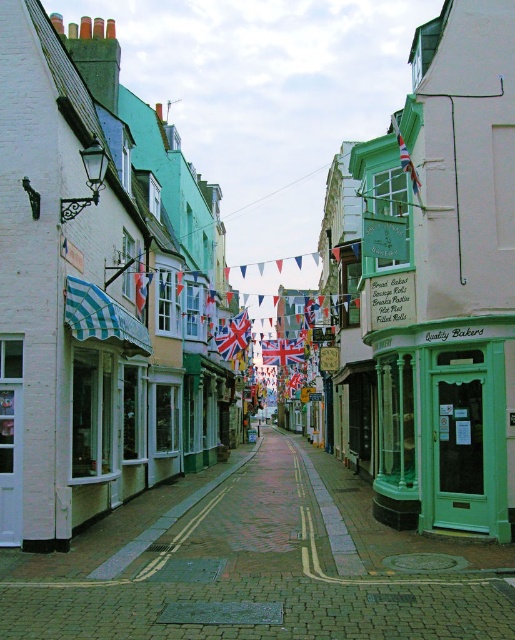
Question: Which object is the closest to the green glass door at center?

Choices:
 (A) union jack fabric flag at center
 (B) union jack fabric flag at upper right

Answer: (B)

Question: Is green glass door at center below union jack fabric flag at center?

Choices:
 (A) yes
 (B) no

Answer: (A)

Question: From the image, what is the correct spatial relationship of green glass door at center in relation to union jack fabric flag at center?

Choices:
 (A) left
 (B) right

Answer: (B)

Question: Which point is farther to the camera?

Choices:
 (A) green glass door at center
 (B) union jack fabric flag at upper right

Answer: (B)

Question: Does union jack fabric flag at center appear on the right side of union jack fabric flag at upper right?

Choices:
 (A) yes
 (B) no

Answer: (B)

Question: Which point is closer to the camera?

Choices:
 (A) green glass door at center
 (B) union jack fabric flag at upper right
 (C) union jack fabric flag at center

Answer: (A)